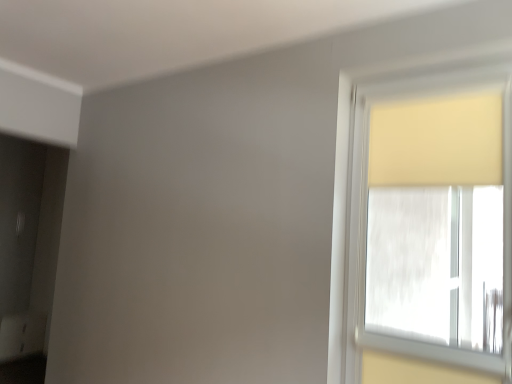
Question: Based on their sizes in the image, would you say matte yellow curtain at right is bigger or smaller than beige fabric curtain at upper right?

Choices:
 (A) big
 (B) small

Answer: (A)

Question: Is matte yellow curtain at right taller or shorter than beige fabric curtain at upper right?

Choices:
 (A) short
 (B) tall

Answer: (B)

Question: From the image's perspective, is matte yellow curtain at right above or below beige fabric curtain at upper right?

Choices:
 (A) above
 (B) below

Answer: (B)

Question: From the image's perspective, is beige fabric curtain at upper right positioned above or below matte yellow curtain at right?

Choices:
 (A) above
 (B) below

Answer: (A)

Question: Considering the relative positions of beige fabric curtain at upper right and matte yellow curtain at right in the image provided, is beige fabric curtain at upper right to the left or to the right of matte yellow curtain at right?

Choices:
 (A) left
 (B) right

Answer: (B)

Question: Considering the positions of beige fabric curtain at upper right and matte yellow curtain at right in the image, is beige fabric curtain at upper right wider or thinner than matte yellow curtain at right?

Choices:
 (A) wide
 (B) thin

Answer: (B)

Question: From a real-world perspective, is beige fabric curtain at upper right physically located above or below matte yellow curtain at right?

Choices:
 (A) above
 (B) below

Answer: (A)